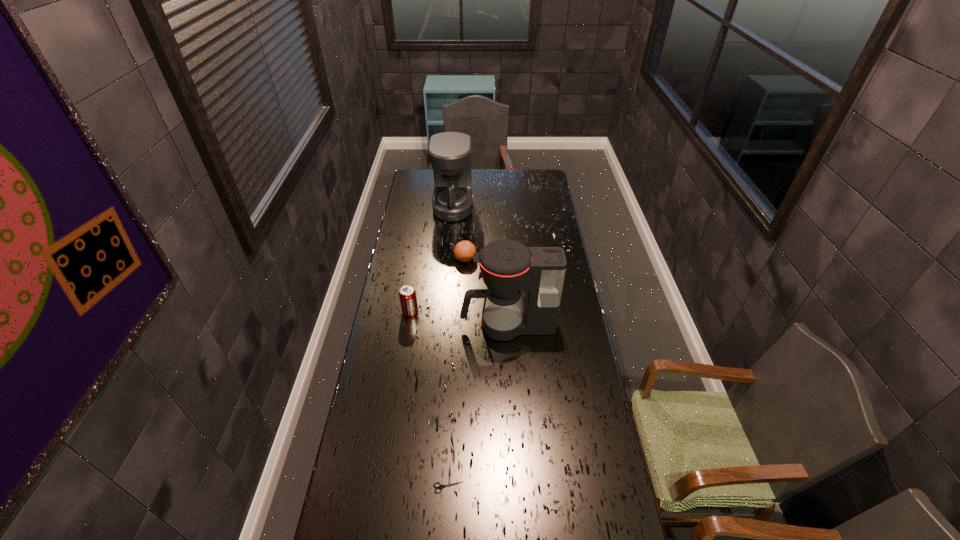
Point out which object is positioned as the third nearest to the nearer coffee maker. Please provide its 2D coordinates. Your answer should be formatted as a tuple, i.e. [(x, y)], where the tuple contains the x and y coordinates of a point satisfying the conditions above.

[(440, 486)]

At what (x,y) coordinates should I click in order to perform the action: click on object that is the third closest to the farther coffee maker. Please return your answer as a coordinate pair (x, y). The height and width of the screenshot is (540, 960). Looking at the image, I should click on (507, 267).

In order to click on free space that satisfies the following two spatial constraints: 1. on the back side of the clementine; 2. on the right side of the shears in this screenshot , I will do `click(460, 258)`.

Locate an element on the screen. vacant space that satisfies the following two spatial constraints: 1. on the button side of the farthest object; 2. on the front side of the third shortest object is located at coordinates (445, 312).

This screenshot has height=540, width=960. What are the coordinates of `free spot that satisfies the following two spatial constraints: 1. on the button side of the farther coffee maker; 2. on the right side of the second shortest object` in the screenshot? It's located at (449, 258).